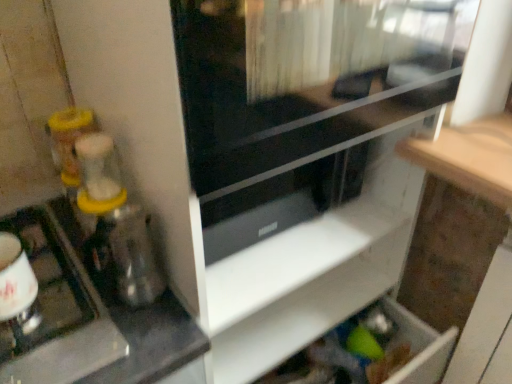
Question: Would you consider transparent plastic blender at left to be distant from white matte drawer at lower center?

Choices:
 (A) no
 (B) yes

Answer: (A)

Question: Is transparent plastic blender at left facing away from white matte drawer at lower center?

Choices:
 (A) yes
 (B) no

Answer: (B)

Question: From a real-world perspective, is transparent plastic blender at left physically above white matte drawer at lower center?

Choices:
 (A) no
 (B) yes

Answer: (B)

Question: Is transparent plastic blender at left positioned behind white matte drawer at lower center?

Choices:
 (A) yes
 (B) no

Answer: (B)

Question: Can you confirm if transparent plastic blender at left is taller than white matte drawer at lower center?

Choices:
 (A) no
 (B) yes

Answer: (B)

Question: Considering the relative sizes of transparent plastic blender at left and white matte drawer at lower center in the image provided, is transparent plastic blender at left smaller than white matte drawer at lower center?

Choices:
 (A) no
 (B) yes

Answer: (B)

Question: Can you confirm if metallic silver kettle at left is smaller than transparent glass screen door at upper center?

Choices:
 (A) no
 (B) yes

Answer: (B)

Question: Does metallic silver kettle at left appear on the right side of transparent glass screen door at upper center?

Choices:
 (A) no
 (B) yes

Answer: (A)

Question: From the image's perspective, does metallic silver kettle at left appear lower than transparent glass screen door at upper center?

Choices:
 (A) no
 (B) yes

Answer: (B)

Question: Does metallic silver kettle at left have a lesser width compared to transparent glass screen door at upper center?

Choices:
 (A) yes
 (B) no

Answer: (A)

Question: From the image's perspective, is metallic silver kettle at left located above transparent glass screen door at upper center?

Choices:
 (A) no
 (B) yes

Answer: (A)

Question: Is metallic silver kettle at left turned away from transparent glass screen door at upper center?

Choices:
 (A) yes
 (B) no

Answer: (B)

Question: Is transparent glass screen door at upper center bigger than metallic silver kettle at left?

Choices:
 (A) no
 (B) yes

Answer: (B)